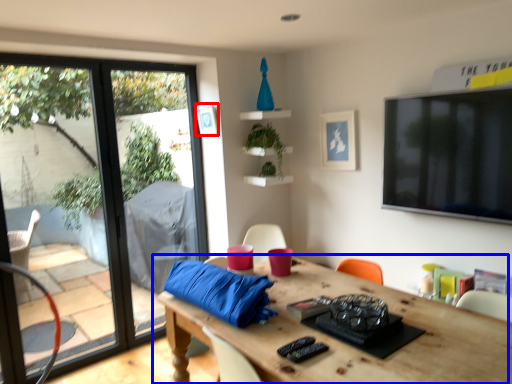
Question: Which point is closer to the camera, picture frame (highlighted by a red box) or table (highlighted by a blue box)?

Choices:
 (A) picture frame
 (B) table

Answer: (B)